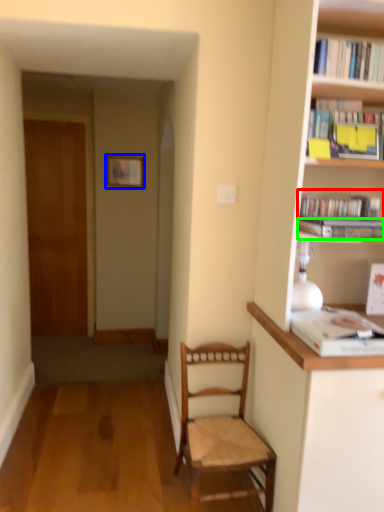
Question: Which object is the closest to the book (highlighted by a red box)? Choose among these: picture frame (highlighted by a blue box) or book (highlighted by a green box).

Choices:
 (A) picture frame
 (B) book

Answer: (B)